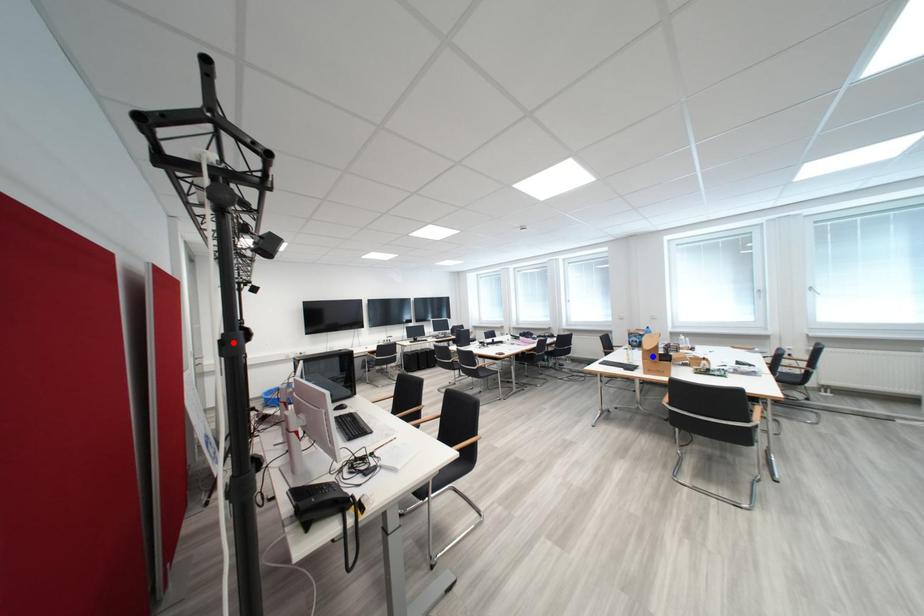
Question: Which of the two points in the image is closer to the camera?

Choices:
 (A) Blue point is closer.
 (B) Red point is closer.

Answer: (B)